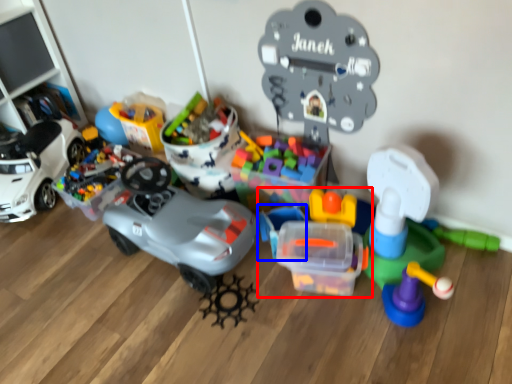
Question: Which object appears farthest to the camera in this image, toy (highlighted by a red box) or toy (highlighted by a blue box)?

Choices:
 (A) toy
 (B) toy

Answer: (B)